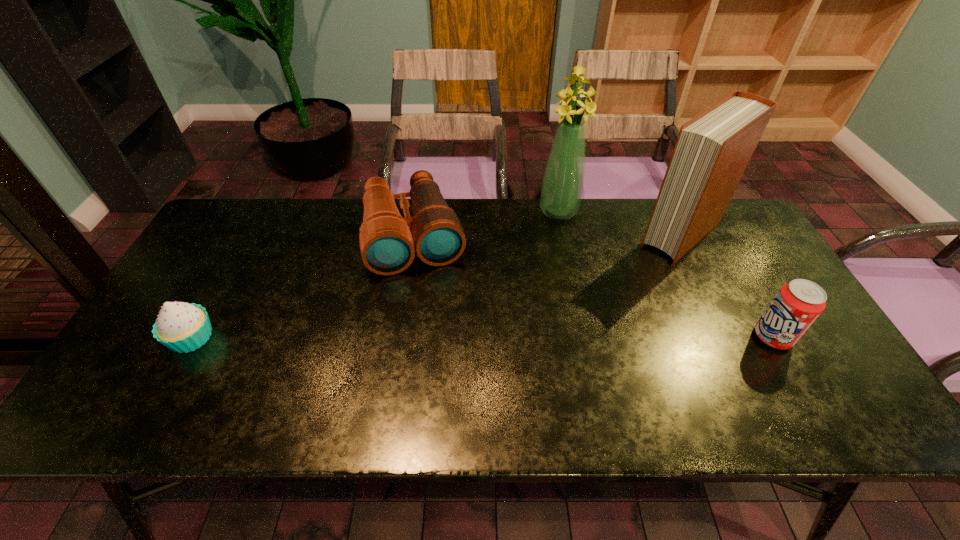
You are a GUI agent. You are given a task and a screenshot of the screen. Output one action in this format:
    pyautogui.click(x=<x>, y=<y>)
    Task: Click on the vacant space on the desktop that is between the leftmost object and the soda can and is positioned on the front-facing side of the third object from left to right
    The width and height of the screenshot is (960, 540).
    Given the screenshot: What is the action you would take?
    pyautogui.click(x=548, y=338)

The width and height of the screenshot is (960, 540). Find the location of `vacant space on the desktop that is between the shortest object and the soda can and is positioned on the open cover of the hardback book`. vacant space on the desktop that is between the shortest object and the soda can and is positioned on the open cover of the hardback book is located at coordinates (562, 338).

Identify the location of free space on the desktop that is between the cupcake and the soda can and is positioned through the lenses of the binoculars. The image size is (960, 540). (441, 338).